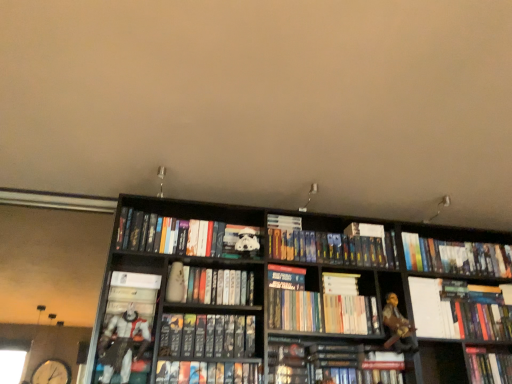
Question: Considering the positions of point (327, 238) and point (373, 312), is point (327, 238) closer or farther from the camera than point (373, 312)?

Choices:
 (A) farther
 (B) closer

Answer: (A)

Question: Is hardcover book at center, the 4th book from the right, situated inside hardcover books at center, the 5th book from the right, or outside?

Choices:
 (A) outside
 (B) inside

Answer: (A)

Question: Which is farther from the hardcover book at center, positioned as the 8th book in left-to-right order?

Choices:
 (A) white matte stormtrooper helmet at center, the 2th book in the left-to-right sequence
 (B) white paper at upper right
 (C) hardcover book at center, marked as the 8th book in a right-to-left arrangement
 (D) hardcover book at lower right, the 1th book viewed from the right
 (E) hardcover book at center, the third book from the left

Answer: (D)

Question: Estimate the real-world distances between objects in this image. Which object is farther from the hardcover book at center, which appears as the ninth book when viewed from the right?

Choices:
 (A) hardcover book at lower right, which is the eleventh book from left to right
 (B) metallic silver figure at left, which is the eleventh book from right to left
 (C) white paper at upper right
 (D) hardcover book at center, marked as the 6th book in a right-to-left arrangement
 (E) hardcover book at center, the 4th book from the left

Answer: (A)